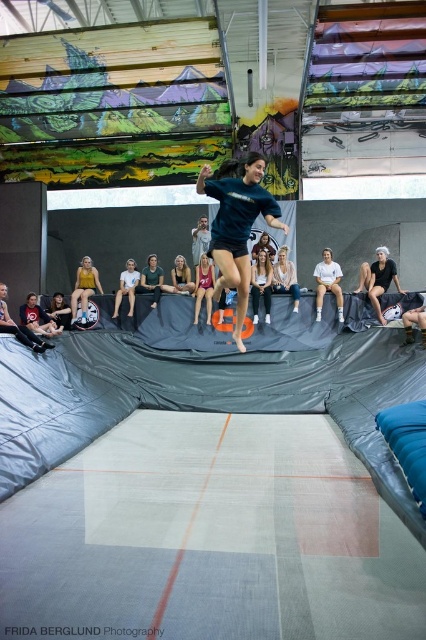
Question: Which object appears farthest from the camera in this image?

Choices:
 (A) dark gray hoodie at lower left
 (B) matte pink swimsuit at center
 (C) matte yellow shirt at center
 (D) matte black helmet at left

Answer: (C)

Question: Which object appears farthest from the camera in this image?

Choices:
 (A) light brown hair at upper center
 (B) black mesh shorts at right
 (C) dark blue shirt at center
 (D) white cotton shirt at center

Answer: (C)

Question: Where is matte blue shirt at center located in relation to matte black leggings at center in the image?

Choices:
 (A) left
 (B) right

Answer: (A)

Question: In this image, where is dark gray hoodie at lower left located relative to light blue fabric at center?

Choices:
 (A) below
 (B) above

Answer: (A)

Question: Does matte black leggings at center have a lesser width compared to dark gray hoodie at lower left?

Choices:
 (A) yes
 (B) no

Answer: (A)

Question: Which point is farther to the camera?

Choices:
 (A) dark gray hoodie at lower left
 (B) white cotton shirt at center

Answer: (B)